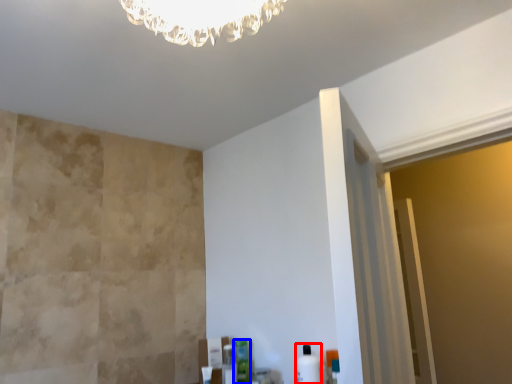
Question: Which object appears closest to the camera in this image, toiletry (highlighted by a red box) or toiletry (highlighted by a blue box)?

Choices:
 (A) toiletry
 (B) toiletry

Answer: (A)